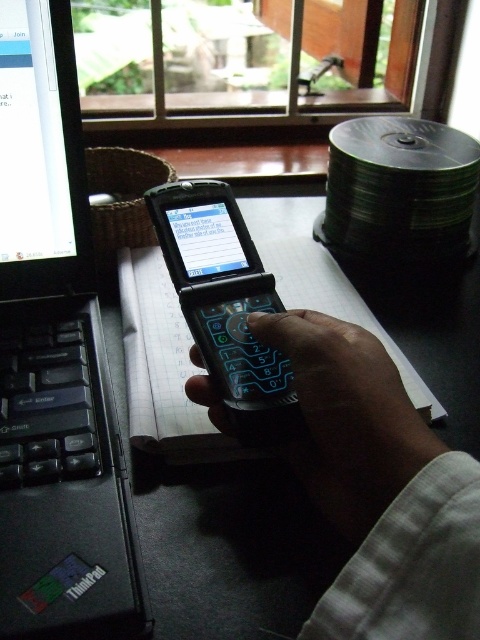
Consider the image. You are organizing items on a desk and need to place a new item between the black plastic phone at center and the black plastic table at center. Based on their positions, where should you place the new item?

The black plastic phone at center is to the left of the black plastic table at center, so you should place the new item between them on the right side of the phone and the left side of the table.

You are trying to locate the black plastic phone at center on the desk. According to the coordinates provided, where exactly is it positioned?

The black plastic phone at center is positioned at point (225, 300).

You are trying to reach for the black matte phone at center and the black plastic phone at center on your desk. Which one can you grab first without moving your hand from its current position?

The black matte phone at center is closer to the viewer, so you can grab it first without moving your hand.